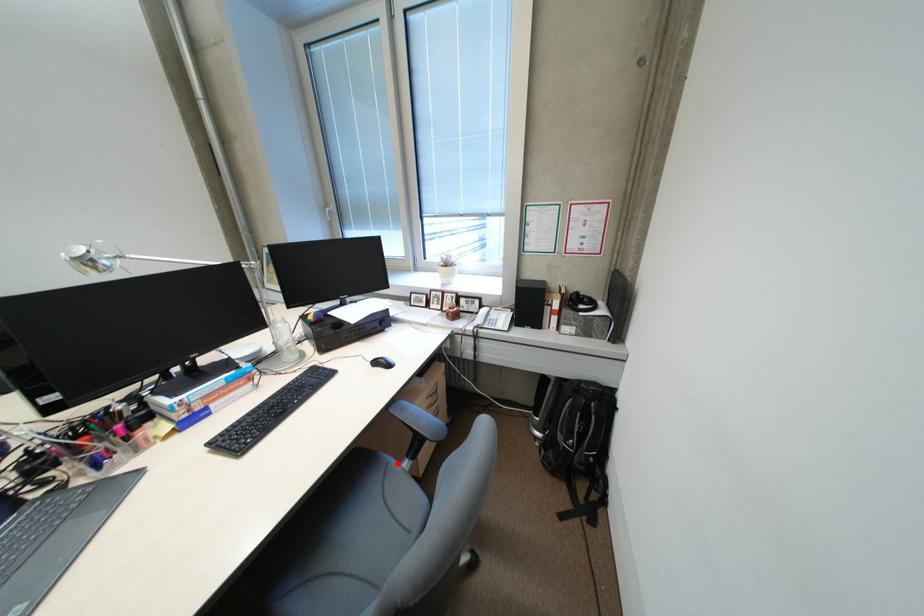
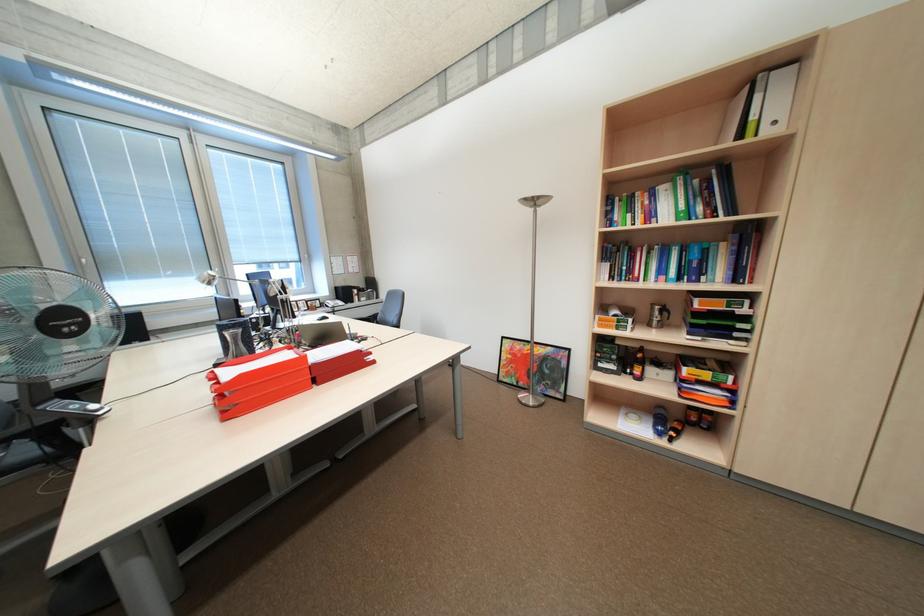
Question: I am providing you with two images of the same scene from different viewpoints. A red point is marked on the first image. Is the red point's position out of view in image 2?

Choices:
 (A) Yes
 (B) No

Answer: (A)